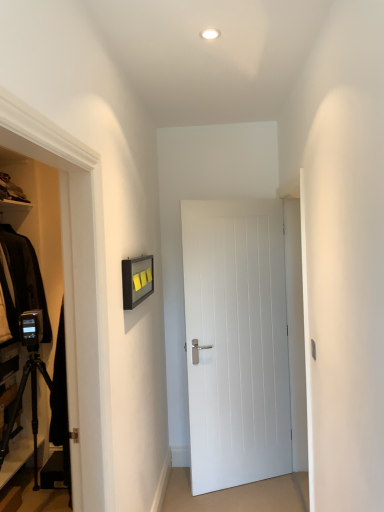
Question: Is white glossy light fixture at upper center positioned beyond the bounds of white smooth door at center?

Choices:
 (A) yes
 (B) no

Answer: (A)

Question: Is white glossy light fixture at upper center directly adjacent to white smooth door at center?

Choices:
 (A) yes
 (B) no

Answer: (B)

Question: Is white smooth door at center at the back of white glossy light fixture at upper center?

Choices:
 (A) no
 (B) yes

Answer: (A)

Question: From a real-world perspective, is white glossy light fixture at upper center positioned over white smooth door at center based on gravity?

Choices:
 (A) yes
 (B) no

Answer: (A)

Question: Does white glossy light fixture at upper center appear on the left side of white smooth door at center?

Choices:
 (A) no
 (B) yes

Answer: (B)

Question: From a real-world perspective, is white smooth door at center positioned above or below white glossy light fixture at upper center?

Choices:
 (A) above
 (B) below

Answer: (B)

Question: From their relative heights in the image, would you say white smooth door at center is taller or shorter than white glossy light fixture at upper center?

Choices:
 (A) tall
 (B) short

Answer: (A)

Question: Is white smooth door at center bigger or smaller than white glossy light fixture at upper center?

Choices:
 (A) big
 (B) small

Answer: (A)

Question: Considering the positions of point (228, 380) and point (213, 32), is point (228, 380) closer or farther from the camera than point (213, 32)?

Choices:
 (A) farther
 (B) closer

Answer: (A)

Question: Considering the positions of black matte tripod at lower left and white glossy light fixture at upper center in the image, is black matte tripod at lower left bigger or smaller than white glossy light fixture at upper center?

Choices:
 (A) big
 (B) small

Answer: (A)

Question: Would you say black matte tripod at lower left is inside or outside white glossy light fixture at upper center?

Choices:
 (A) outside
 (B) inside

Answer: (A)

Question: Looking at their shapes, would you say black matte tripod at lower left is wider or thinner than white glossy light fixture at upper center?

Choices:
 (A) thin
 (B) wide

Answer: (B)

Question: From the image's perspective, is black matte tripod at lower left positioned above or below white glossy light fixture at upper center?

Choices:
 (A) above
 (B) below

Answer: (B)

Question: In terms of size, does white smooth door at center appear bigger or smaller than black matte tripod at lower left?

Choices:
 (A) small
 (B) big

Answer: (A)

Question: In the image, is white smooth door at center on the left side or the right side of black matte tripod at lower left?

Choices:
 (A) left
 (B) right

Answer: (B)